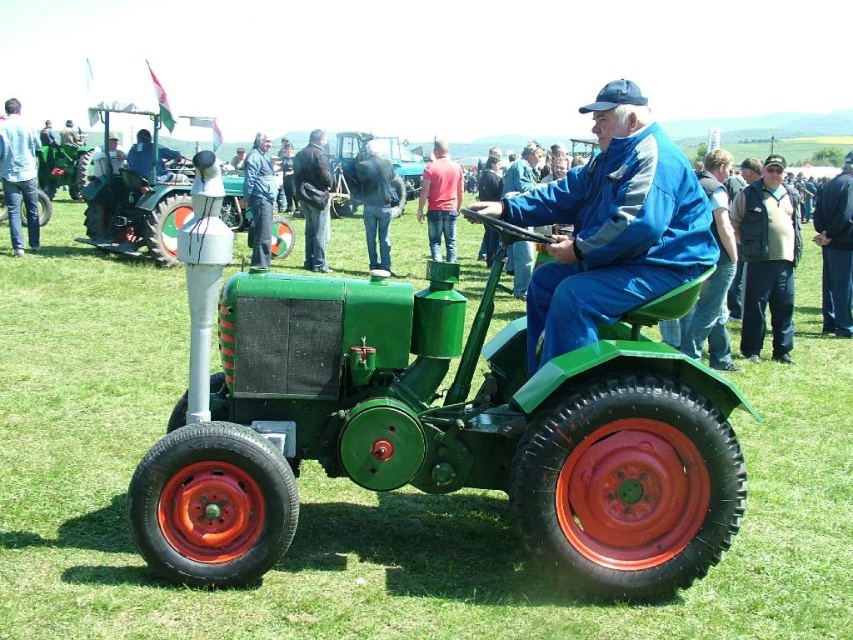
Question: Estimate the real-world distances between objects in this image. Which object is closer to the red shirt at center?

Choices:
 (A) green grass at center
 (B) blue fabric jacket at center
 (C) brushed metal cap at upper left

Answer: (C)

Question: Can you confirm if red shirt at center is positioned to the left of blue denim jacket at center?

Choices:
 (A) yes
 (B) no

Answer: (B)

Question: Where is blue fabric jacket at center located in relation to dark gray fabric jacket at center in the image?

Choices:
 (A) above
 (B) below

Answer: (B)

Question: Which of the following is the closest to the observer?

Choices:
 (A) (260, 141)
 (B) (84, 168)

Answer: (A)

Question: Among these points, which one is farthest from the camera?

Choices:
 (A) (767, 266)
 (B) (555, 198)

Answer: (A)

Question: Considering the relative positions of dark blue vest at right and brushed metal cap at upper left in the image provided, where is dark blue vest at right located with respect to brushed metal cap at upper left?

Choices:
 (A) left
 (B) right

Answer: (B)